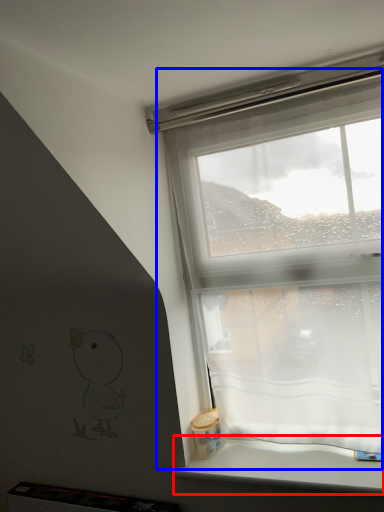
Question: Which of the following is the closest to the observer, window sill (highlighted by a red box) or window (highlighted by a blue box)?

Choices:
 (A) window sill
 (B) window

Answer: (A)